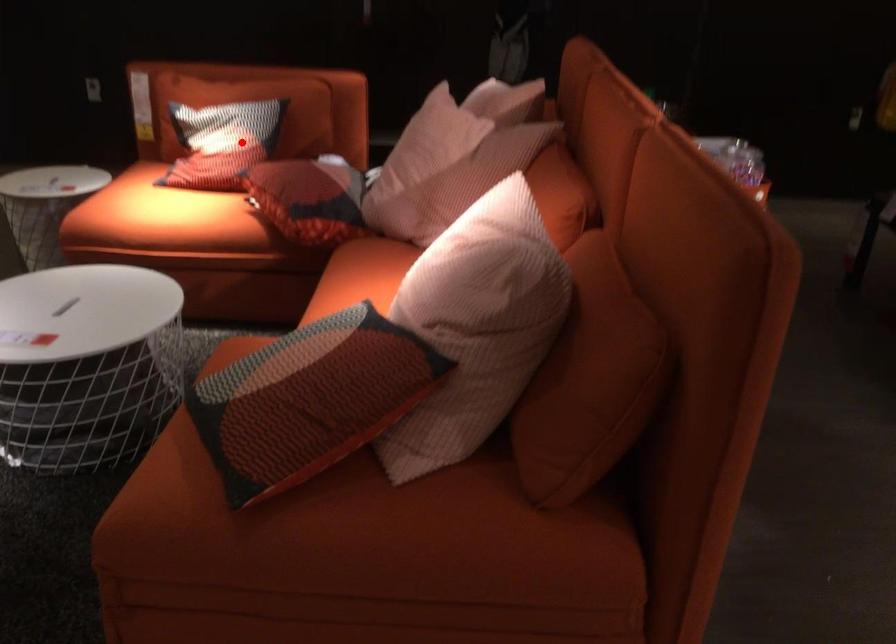
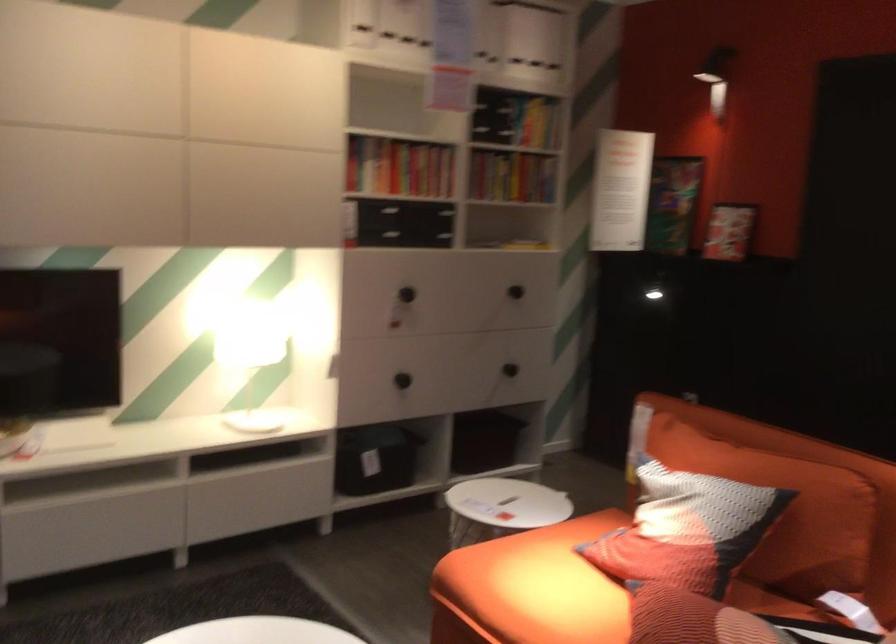
Where in the second image is the point corresponding to the highlighted location from the first image?

(686, 529)